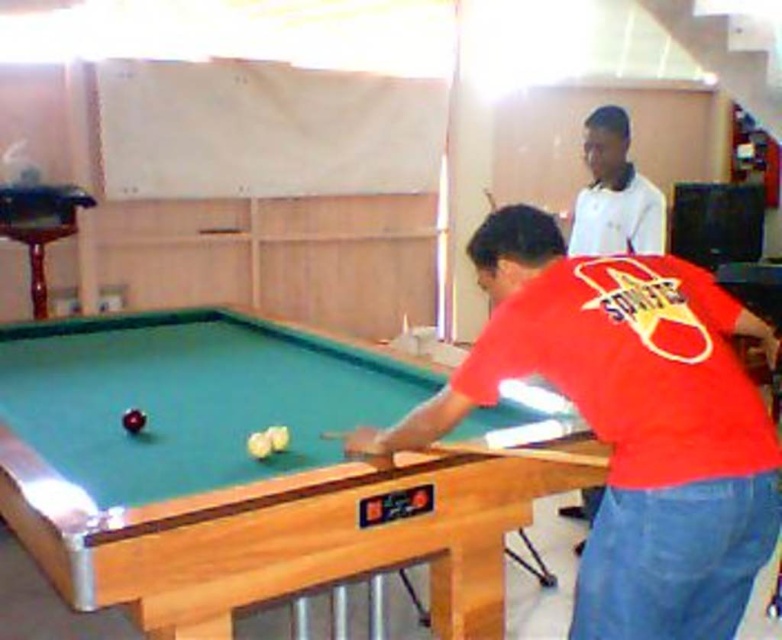
The width and height of the screenshot is (782, 640). What do you see at coordinates (237, 472) in the screenshot?
I see `green felt pool table at center` at bounding box center [237, 472].

Can you confirm if green felt pool table at center is taller than red matte shirt at center?

No.

Between point (83, 429) and point (547, 374), which one is positioned in front?

Point (547, 374)

The width and height of the screenshot is (782, 640). I want to click on green felt pool table at center, so click(x=237, y=472).

This screenshot has width=782, height=640. Identify the location of red matte shirt at center. (630, 420).

Which of these two, red matte shirt at center or white smooth shirt at upper center, stands shorter?

Standing shorter between the two is white smooth shirt at upper center.

Where is `red matte shirt at center`? This screenshot has width=782, height=640. red matte shirt at center is located at coordinates (630, 420).

This screenshot has height=640, width=782. What are the coordinates of `red matte shirt at center` in the screenshot? It's located at (630, 420).

Measure the distance between green felt pool table at center and white smooth shirt at upper center.

green felt pool table at center and white smooth shirt at upper center are 5.97 feet apart from each other.

Which is above, green felt pool table at center or white smooth shirt at upper center?

white smooth shirt at upper center is higher up.

Is point (171, 339) behind point (626, 166)?

Yes, it is behind point (626, 166).

At what (x,y) coordinates should I click in order to perform the action: click on green felt pool table at center. Please return your answer as a coordinate pair (x, y). Looking at the image, I should click on (237, 472).